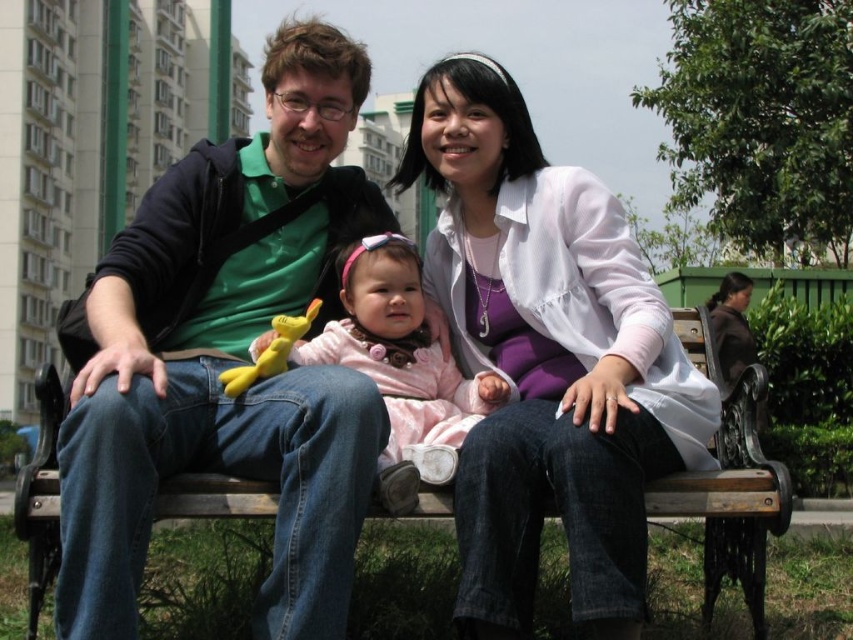
You are trying to decide which clothing item to take for a casual day out. Based on the image, which clothing item is narrower between the green matte shirt at left and the white matte jacket at center?

The green matte shirt at left is narrower than the white matte jacket at center because its width is less than the jacket.